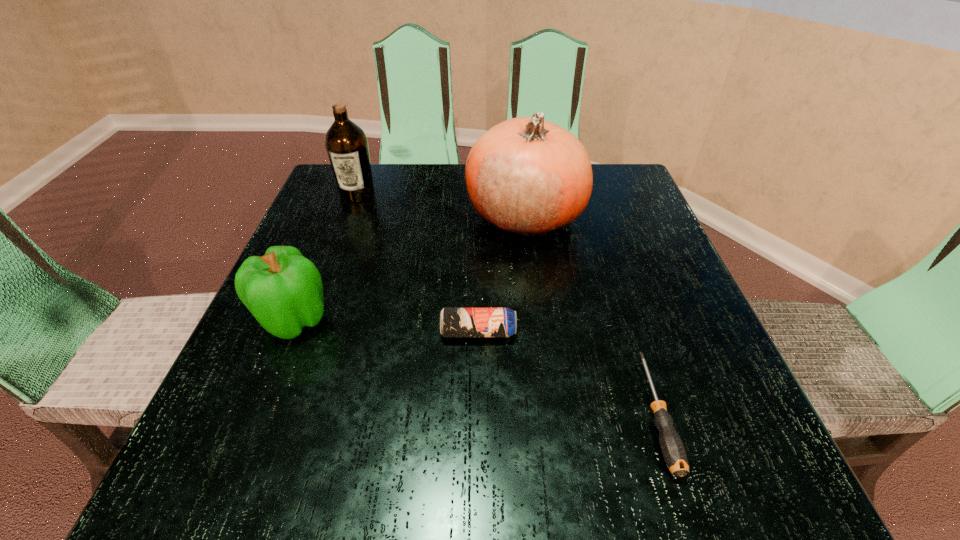
Locate an element on the screen. pumpkin is located at coordinates (527, 176).

Where is `olive oil`? The width and height of the screenshot is (960, 540). olive oil is located at coordinates (346, 143).

You are a GUI agent. You are given a task and a screenshot of the screen. Output one action in this format:
    pyautogui.click(x=<x>, y=<y>)
    Task: Click on the bell pepper
    Image resolution: width=960 pixels, height=540 pixels.
    Given the screenshot: What is the action you would take?
    pyautogui.click(x=283, y=290)

Find the location of a particular element. the second shortest object is located at coordinates (454, 322).

Identify the location of screwdriver. (672, 448).

Find the location of a particular element. The width and height of the screenshot is (960, 540). the rightmost object is located at coordinates (672, 448).

Where is `free space located on the back of the pumpkin`? free space located on the back of the pumpkin is located at coordinates (518, 166).

Where is `free region located 0.330m on the label of the olive oil`? Image resolution: width=960 pixels, height=540 pixels. free region located 0.330m on the label of the olive oil is located at coordinates (314, 310).

Identify the location of vacant space located on the front of the bell pepper. (272, 374).

In order to click on vacant area situated 0.260m on the right of the beer can in this screenshot , I will do `click(671, 332)`.